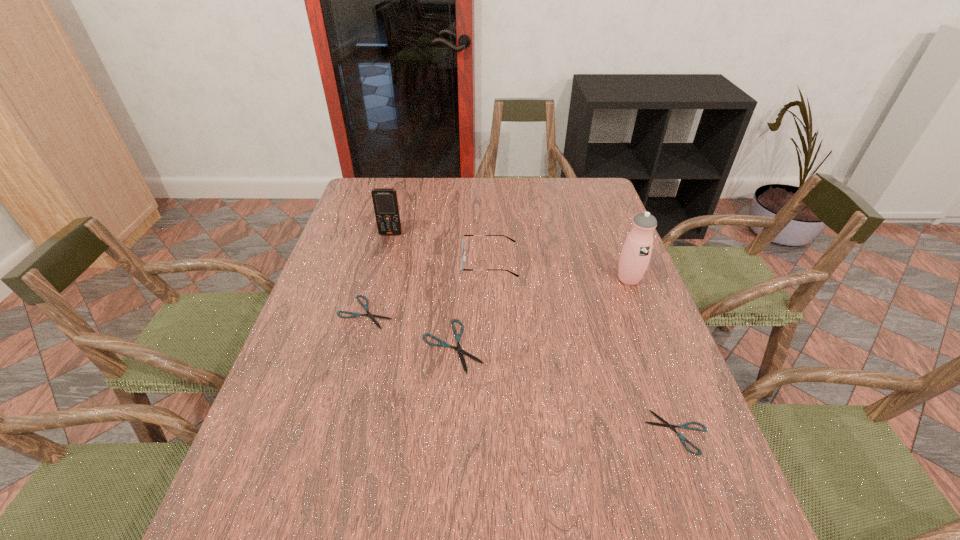
Where is `the fourth closest object to the thermos bottle`? the fourth closest object to the thermos bottle is located at coordinates point(371,316).

This screenshot has width=960, height=540. In order to click on the second closest shears relative to the shortest object in this screenshot , I will do `click(371, 316)`.

Select which shears appears as the third closest to the farthest object. Please provide its 2D coordinates. Your answer should be formatted as a tuple, i.e. [(x, y)], where the tuple contains the x and y coordinates of a point satisfying the conditions above.

[(685, 426)]

Identify the location of vacant space that satisfies the following two spatial constraints: 1. on the screen of the second tallest object; 2. on the left side of the tallest object. The image size is (960, 540). (379, 279).

The image size is (960, 540). Identify the location of vacant area in the image that satisfies the following two spatial constraints: 1. on the lenses of the spectacles; 2. on the front side of the second shears from right to left. (492, 346).

Locate an element on the screen. The image size is (960, 540). vacant region that satisfies the following two spatial constraints: 1. on the lenses of the tallest object; 2. on the right side of the third tallest object is located at coordinates (490, 279).

This screenshot has width=960, height=540. Find the location of `free space that satisfies the following two spatial constraints: 1. on the lenses of the shortest shears; 2. on the left side of the spectacles`. free space that satisfies the following two spatial constraints: 1. on the lenses of the shortest shears; 2. on the left side of the spectacles is located at coordinates (494, 432).

What are the coordinates of `free space that satisfies the following two spatial constraints: 1. on the lenses of the thermos bottle; 2. on the right side of the third tallest object` in the screenshot? It's located at (490, 279).

Where is `free space in the image that satisfies the following two spatial constraints: 1. on the back side of the leftmost shears; 2. on the left side of the tallest object`? free space in the image that satisfies the following two spatial constraints: 1. on the back side of the leftmost shears; 2. on the left side of the tallest object is located at coordinates (374, 279).

This screenshot has width=960, height=540. Find the location of `blank area in the image that satisfies the following two spatial constraints: 1. on the screen of the farthest object; 2. on the right side of the second shears from right to left`. blank area in the image that satisfies the following two spatial constraints: 1. on the screen of the farthest object; 2. on the right side of the second shears from right to left is located at coordinates (362, 346).